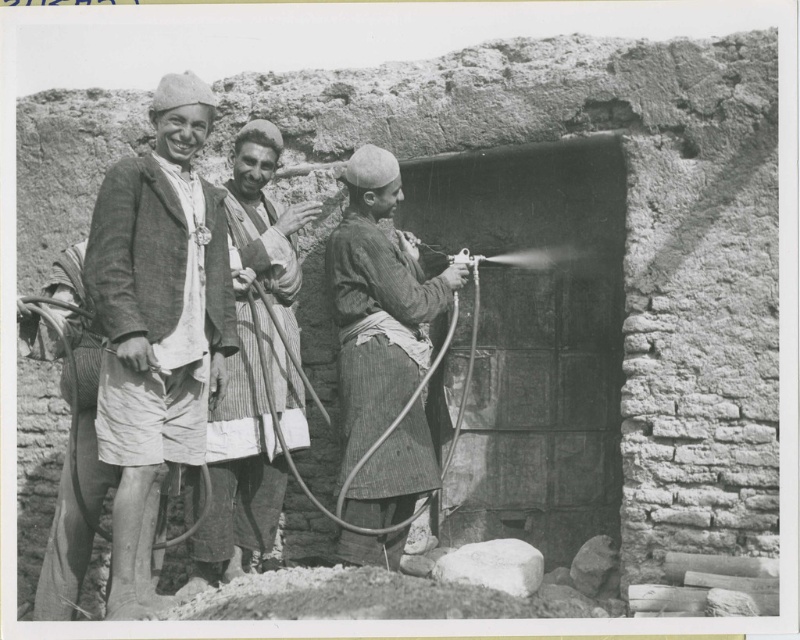
Question: Is matte white shirt at left behind striped fabric spray gun at center?

Choices:
 (A) yes
 (B) no

Answer: (B)

Question: Which object appears farthest from the camera in this image?

Choices:
 (A) striped fabric spray gun at center
 (B) matte white shirt at left
 (C) striped fabric shirt at center

Answer: (C)

Question: Which of these objects is positioned closest to the striped fabric shirt at center?

Choices:
 (A) striped fabric spray gun at center
 (B) matte white shirt at left

Answer: (A)

Question: Can you confirm if striped fabric spray gun at center is positioned to the right of striped fabric shirt at center?

Choices:
 (A) yes
 (B) no

Answer: (A)

Question: Among these objects, which one is farthest from the camera?

Choices:
 (A) striped fabric shirt at center
 (B) matte white shirt at left
 (C) striped fabric spray gun at center

Answer: (A)

Question: Is matte white shirt at left below striped fabric shirt at center?

Choices:
 (A) yes
 (B) no

Answer: (A)